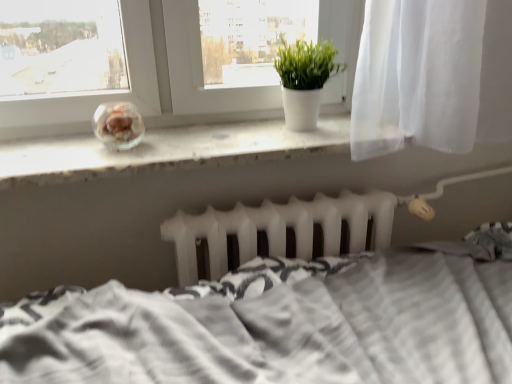
Describe the element at coordinates (119, 122) in the screenshot. I see `translucent glass jar at center` at that location.

You are a GUI agent. You are given a task and a screenshot of the screen. Output one action in this format:
    pyautogui.click(x=<x>, y=<y>)
    Task: Click on the green matte plant at center
    The height and width of the screenshot is (384, 512).
    Given the screenshot: What is the action you would take?
    pyautogui.click(x=304, y=80)

What is the approximate width of white matte radiator at center?

4.84 inches.

Image resolution: width=512 pixels, height=384 pixels. I want to click on translucent glass jar at center, so click(x=119, y=122).

Locate an element on the screen. This screenshot has width=512, height=384. bed below the green matte plant at center (from the image's perspective) is located at coordinates (283, 322).

Does point (256, 299) lie in front of point (317, 91)?

Yes, it is.

Considering the sizes of objects white textured bed at center and green matte plant at center in the image provided, who is taller, white textured bed at center or green matte plant at center?

white textured bed at center is taller.

Which object is wider, translucent glass jar at center or white matte radiator at center?

With larger width is translucent glass jar at center.

In the image, is translucent glass jar at center positioned in front of or behind white matte radiator at center?

translucent glass jar at center is positioned closer to the viewer than white matte radiator at center.

Considering the positions of point (108, 136) and point (178, 221), is point (108, 136) closer or farther from the camera than point (178, 221)?

Point (108, 136) is closer to the camera than point (178, 221).

Is translucent glass jar at center oriented away from white matte radiator at center?

No, white matte radiator at center is not at the back of translucent glass jar at center.

Looking at this image, considering the relative sizes of white matte window sill at center and translucent glass jar at center in the image provided, is white matte window sill at center wider than translucent glass jar at center?

Yes.

Which object is closer to the camera, white matte window sill at center or translucent glass jar at center?

white matte window sill at center.

Could you tell me if white matte window sill at center is turned towards translucent glass jar at center?

No.

Which of these two, white matte window sill at center or white matte radiator at center, stands shorter?

Standing shorter between the two is white matte window sill at center.

Is white matte window sill at center aimed at white matte radiator at center?

No, white matte window sill at center is not facing towards white matte radiator at center.

What are the coordinates of `radiator behind the white matte window sill at center` in the screenshot? It's located at (279, 229).

Image resolution: width=512 pixels, height=384 pixels. I want to click on houseplant lying above the white matte radiator at center (from the image's perspective), so click(x=304, y=80).

In terms of height, does white matte radiator at center look taller or shorter compared to green matte plant at center?

In the image, white matte radiator at center appears to be shorter than green matte plant at center.

Which is behind, point (285, 244) or point (295, 120)?

The point (295, 120) is farther.

Can you confirm if white matte radiator at center is positioned to the right of green matte plant at center?

Incorrect, white matte radiator at center is not on the right side of green matte plant at center.

Could you tell me if green matte plant at center is facing white matte radiator at center?

No, green matte plant at center is not facing towards white matte radiator at center.

From the image's perspective, is green matte plant at center located above or below white matte radiator at center?

green matte plant at center is situated higher than white matte radiator at center in the image.

Which object is further away from the camera, green matte plant at center or white matte radiator at center?

green matte plant at center is further from the camera.

From a real-world perspective, relative to white matte radiator at center, is green matte plant at center vertically above or below?

In terms of real-world spatial position, green matte plant at center is above white matte radiator at center.

Which is more to the left, white textured bed at center or white matte radiator at center?

white matte radiator at center.

Is the depth of white textured bed at center greater than that of white matte radiator at center?

That is False.

Can you confirm if white textured bed at center is thinner than white matte radiator at center?

No.

Find the location of a particular element. This screenshot has height=384, width=512. houseplant on the left of white textured bed at center is located at coordinates (304, 80).

Locate an element on the screen. Image resolution: width=512 pixels, height=384 pixels. food above the white matte radiator at center (from the image's perspective) is located at coordinates (119, 122).

Looking at the image, which one is located further to green matte plant at center, translucent glass jar at center or white matte window sill at center?

translucent glass jar at center.

When comparing their distances from translucent glass jar at center, does white textured bed at center or white matte radiator at center seem further?

Among the two, white textured bed at center is located further to translucent glass jar at center.

Estimate the real-world distances between objects in this image. Which object is further from translucent glass jar at center, white matte radiator at center or white textured bed at center?

Based on the image, white textured bed at center appears to be further to translucent glass jar at center.

Estimate the real-world distances between objects in this image. Which object is closer to white textured bed at center, white matte window sill at center or green matte plant at center?

white matte window sill at center.

Consider the image. Estimate the real-world distances between objects in this image. Which object is further from green matte plant at center, translucent glass jar at center or white matte radiator at center?

Based on the image, translucent glass jar at center appears to be further to green matte plant at center.

Considering their positions, is green matte plant at center positioned closer to translucent glass jar at center than white matte radiator at center?

white matte radiator at center is closer to translucent glass jar at center.

Looking at the image, which one is located further to white textured bed at center, green matte plant at center or white matte window sill at center?

green matte plant at center lies further to white textured bed at center than the other object.

Looking at the image, which one is located further to white matte radiator at center, white textured bed at center or white matte window sill at center?

white matte window sill at center is positioned further to the anchor white matte radiator at center.

At what (x,y) coordinates should I click in order to perform the action: click on window sill between translucent glass jar at center and white textured bed at center in the vertical direction. Please return your answer as a coordinate pair (x, y). Looking at the image, I should click on (166, 151).

Locate an element on the screen. The height and width of the screenshot is (384, 512). radiator between green matte plant at center and white textured bed at center in the up-down direction is located at coordinates (279, 229).

Where is `radiator that lies between translucent glass jar at center and white textured bed at center from top to bottom`? The width and height of the screenshot is (512, 384). radiator that lies between translucent glass jar at center and white textured bed at center from top to bottom is located at coordinates [279, 229].

At what (x,y) coordinates should I click in order to perform the action: click on window sill between translucent glass jar at center and white matte radiator at center from left to right. Please return your answer as a coordinate pair (x, y). The image size is (512, 384). Looking at the image, I should click on (x=166, y=151).